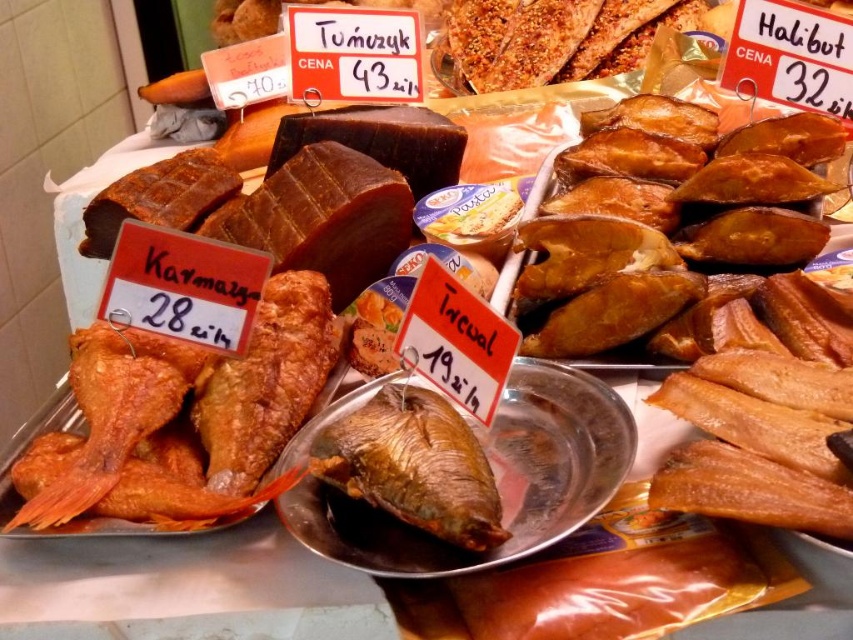
Question: Which is farther from the brown smoked fish at right?

Choices:
 (A) brown matte fish at center
 (B) golden brown dried fish at center

Answer: (A)

Question: Does brown smoked fish at right have a smaller size compared to brown matte fish at center?

Choices:
 (A) no
 (B) yes

Answer: (A)

Question: Is golden brown dried fish at center further to camera compared to brown matte fish at center?

Choices:
 (A) no
 (B) yes

Answer: (A)

Question: Which point is closer to the camera?

Choices:
 (A) (352, 436)
 (B) (808, 168)
 (C) (357, 560)

Answer: (C)

Question: Which point is farther to the camera?

Choices:
 (A) (444, 573)
 (B) (734, 154)
 (C) (397, 452)

Answer: (B)

Question: Is brown smoked fish at right below golden brown dried fish at center?

Choices:
 (A) no
 (B) yes

Answer: (A)